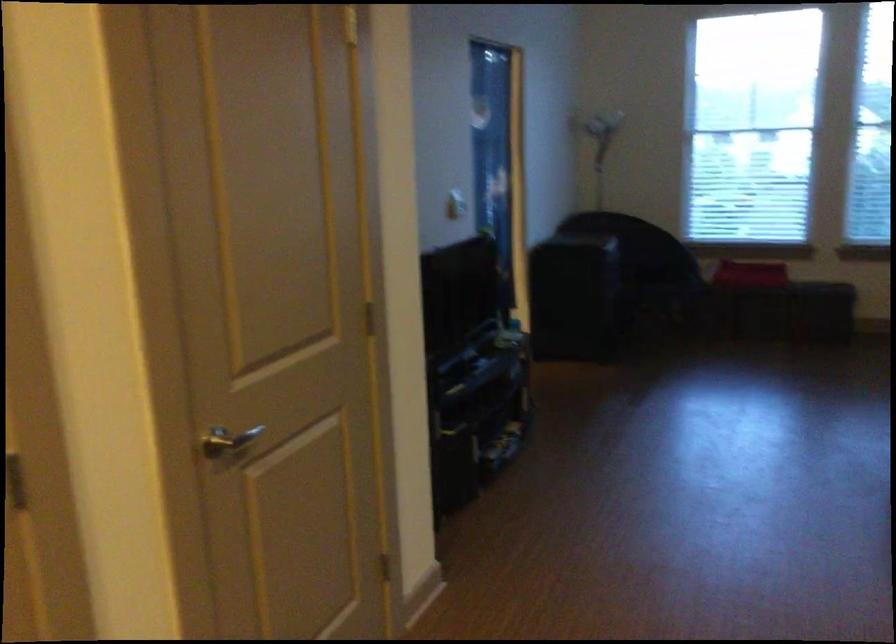
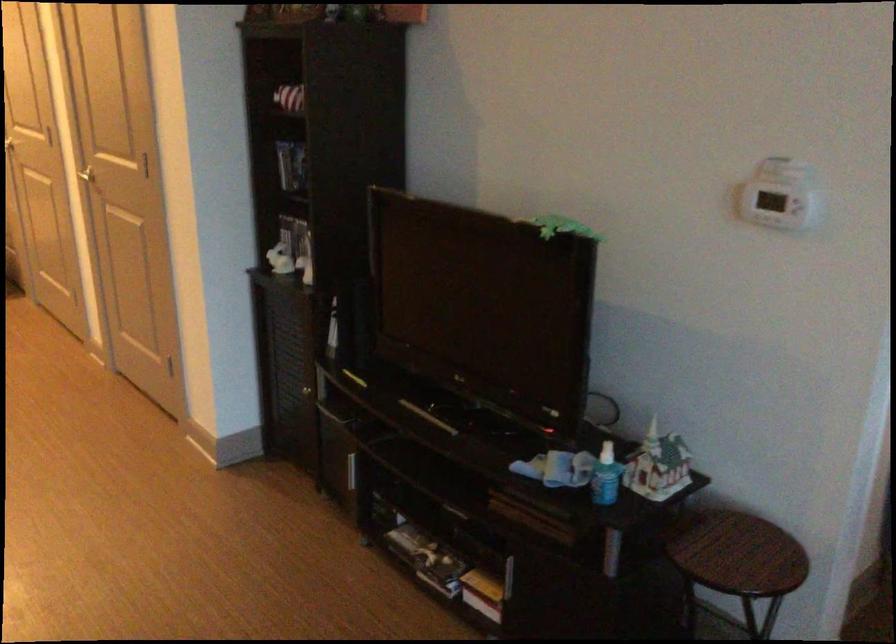
Where in the second image is the point corresponding to the point at 506,327 from the first image?

(733, 547)